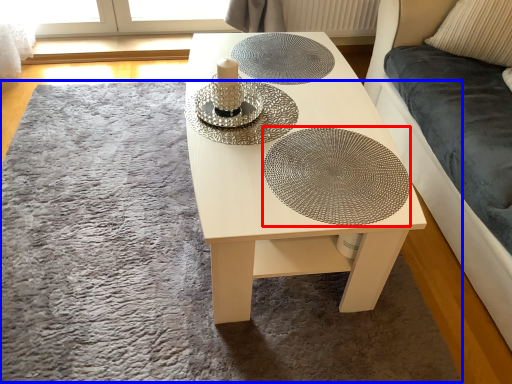
Question: Which of the following is the farthest to the observer, glass plate (highlighted by a red box) or mat (highlighted by a blue box)?

Choices:
 (A) glass plate
 (B) mat

Answer: (A)